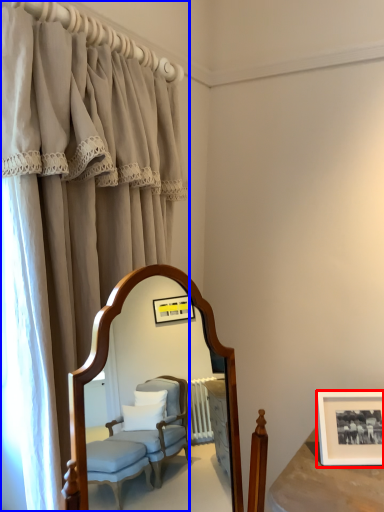
Question: Which point is closer to the camera, picture frame (highlighted by a red box) or curtain (highlighted by a blue box)?

Choices:
 (A) picture frame
 (B) curtain

Answer: (B)